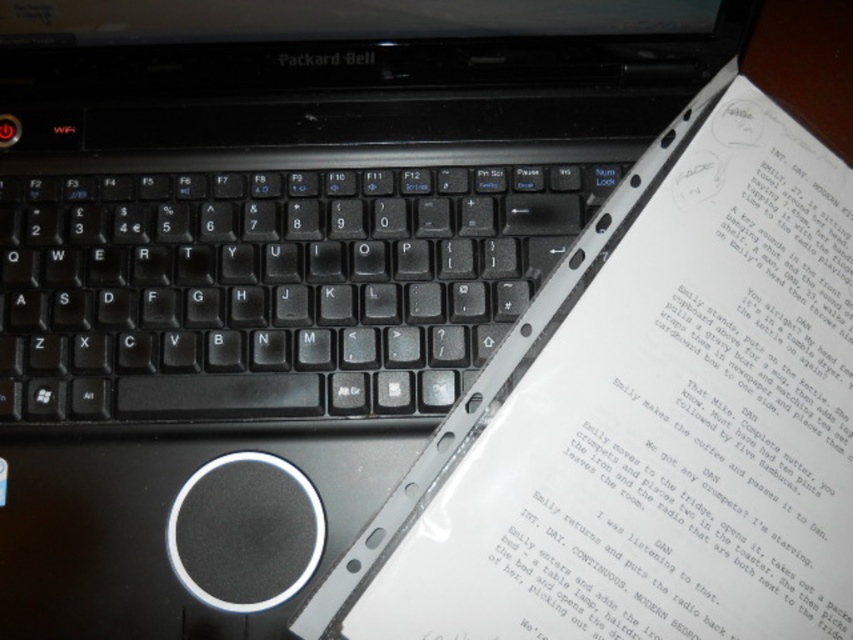
Image resolution: width=853 pixels, height=640 pixels. Describe the element at coordinates (659, 419) in the screenshot. I see `white paper at upper right` at that location.

Does white paper at upper right appear on the right side of black plastic keyboard at center?

Correct, you'll find white paper at upper right to the right of black plastic keyboard at center.

Between point (624, 595) and point (206, 358), which one is positioned in front?

Point (624, 595) is in front.

What are the coordinates of `white paper at upper right` in the screenshot? It's located at (659, 419).